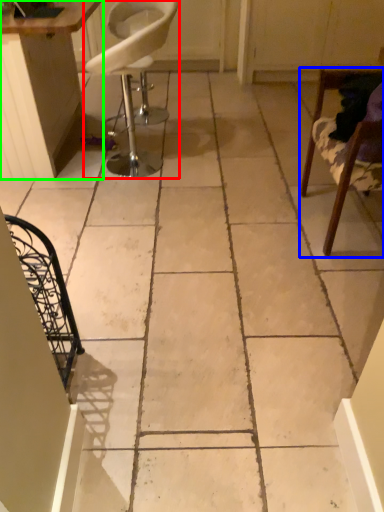
Question: Which is farther away from chair (highlighted by a red box)? chair (highlighted by a blue box) or table (highlighted by a green box)?

Choices:
 (A) chair
 (B) table

Answer: (A)